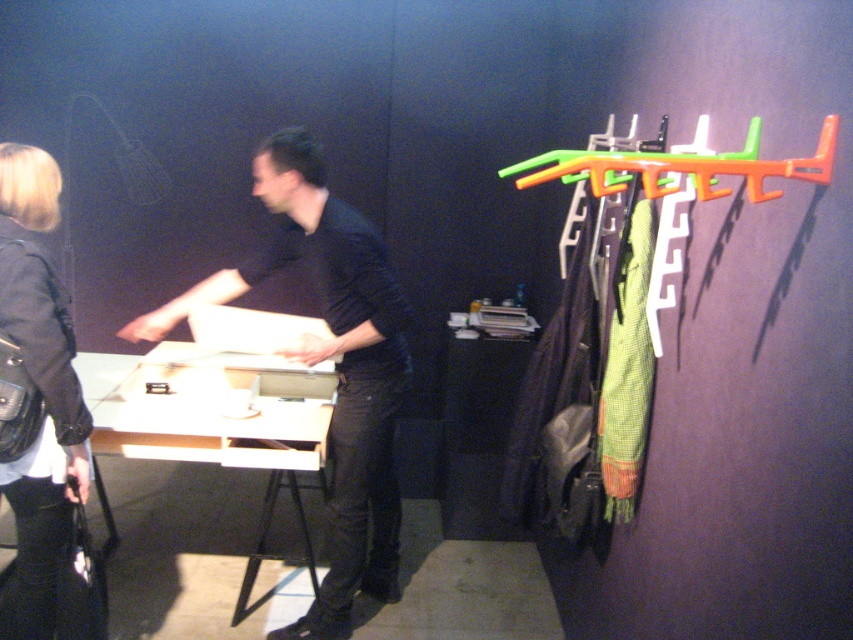
You are a delivery person who just arrived at the gallery. You need to place a matte black shirt at center on a table. The shirt must be placed exactly on the white matte table at center. However, you can only move the shirt 10 inches. Can you place the shirt on the table?

The matte black shirt at center is 11.77 inches away from the white matte table at center. Since the shirt needs to be moved 11.77 inches but you can only move it 10 inches, you cannot place the shirt on the table.

You are a fashion designer who wants to place a new accessory exactly at the same position as the matte black shirt at center. What are the coordinates where you should place the accessory?

The coordinates for the matte black shirt at center are at point [335,364], so you should place the accessory at those coordinates.

You are a tailor who needs to store a new item in a narrow closet. You have to choose between placing the black leather jacket at lower left or the orange plastic hanger at right. Which item would require less space due to its thinner profile?

The black leather jacket at lower left is thinner than the orange plastic hanger at right, so it would require less space in the narrow closet.